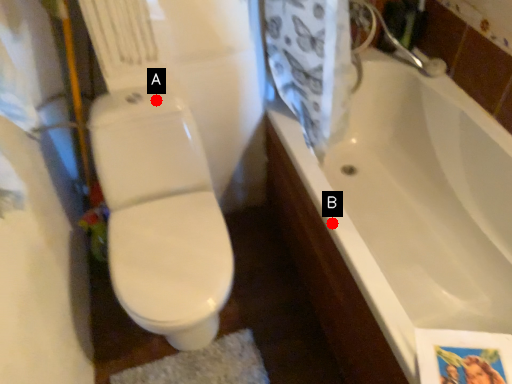
Question: Two points are circled on the image, labeled by A and B beside each circle. Which of the following is the farthest from the observer?

Choices:
 (A) A is further
 (B) B is further

Answer: (A)